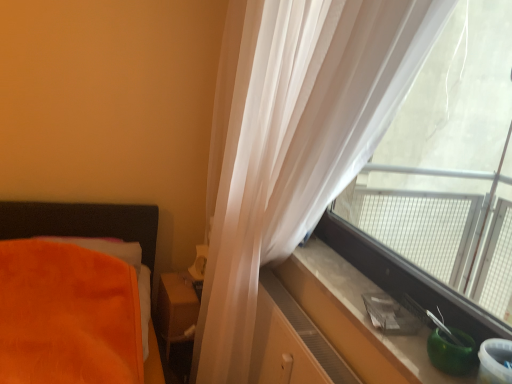
Image resolution: width=512 pixels, height=384 pixels. In order to click on vacant area on top of smooth concrete window sill at right (from a real-world perspective) in this screenshot , I will do `click(375, 298)`.